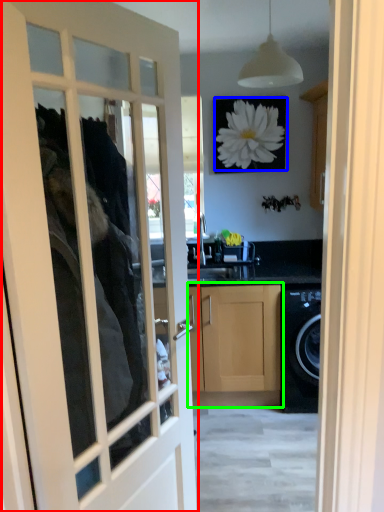
Question: Which object is the farthest from door (highlighted by a red box)? Choose among these: flower (highlighted by a blue box) or cabinetry (highlighted by a green box).

Choices:
 (A) flower
 (B) cabinetry

Answer: (A)